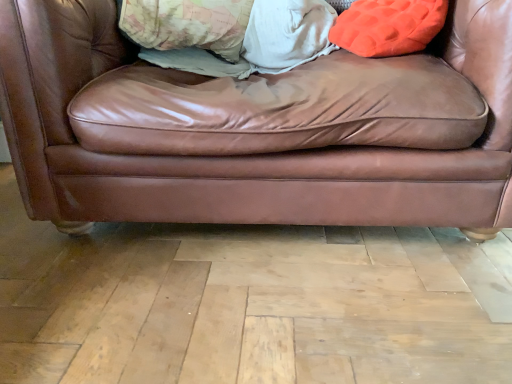
Image resolution: width=512 pixels, height=384 pixels. I want to click on brown leather couch at center, so click(x=231, y=137).

This screenshot has height=384, width=512. What do you see at coordinates (388, 26) in the screenshot?
I see `orange fuzzy pillow at upper right` at bounding box center [388, 26].

You are a GUI agent. You are given a task and a screenshot of the screen. Output one action in this format:
    pyautogui.click(x=<x>, y=<y>)
    Task: Click on the orange fuzzy pillow at upper right
    This screenshot has width=512, height=384.
    Given the screenshot: What is the action you would take?
    pyautogui.click(x=388, y=26)

Where is `brown leather couch at center`? The image size is (512, 384). brown leather couch at center is located at coordinates (231, 137).

Is patterned fabric pillow at upper center taller than orange fuzzy pillow at upper right?

Indeed, patterned fabric pillow at upper center has a greater height compared to orange fuzzy pillow at upper right.

This screenshot has width=512, height=384. Find the location of `throw pillow in front of the patterned fabric pillow at upper center`. throw pillow in front of the patterned fabric pillow at upper center is located at coordinates (388, 26).

Would you say patterned fabric pillow at upper center is to the left or to the right of orange fuzzy pillow at upper right in the picture?

Based on their positions, patterned fabric pillow at upper center is located to the left of orange fuzzy pillow at upper right.

Who is smaller, patterned fabric pillow at upper center or orange fuzzy pillow at upper right?

Smaller between the two is orange fuzzy pillow at upper right.

How far apart are orange fuzzy pillow at upper right and patterned fabric pillow at upper center?

They are 17.30 inches apart.

From the image's perspective, is orange fuzzy pillow at upper right below patterned fabric pillow at upper center?

Indeed, from the image's perspective, orange fuzzy pillow at upper right is shown beneath patterned fabric pillow at upper center.

Is orange fuzzy pillow at upper right at the left side of patterned fabric pillow at upper center?

Incorrect, orange fuzzy pillow at upper right is not on the left side of patterned fabric pillow at upper center.

Can we say orange fuzzy pillow at upper right lies outside patterned fabric pillow at upper center?

Indeed, orange fuzzy pillow at upper right is completely outside patterned fabric pillow at upper center.

Is point (14, 103) farther from viewer compared to point (348, 39)?

No, it is in front of (348, 39).

Does brown leather couch at center have a smaller size compared to orange fuzzy pillow at upper right?

No.

Does point (229, 32) appear closer or farther from the camera than point (324, 170)?

Point (229, 32) is positioned farther from the camera compared to point (324, 170).

Which of these two, patterned fabric pillow at upper center or brown leather couch at center, is smaller?

patterned fabric pillow at upper center is smaller.

Considering the relative sizes of patterned fabric pillow at upper center and brown leather couch at center in the image provided, is patterned fabric pillow at upper center wider than brown leather couch at center?

No.

Is brown leather couch at center behind patterned fabric pillow at upper center?

No, brown leather couch at center is closer to the viewer.

Is patterned fabric pillow at upper center completely or partially inside brown leather couch at center?

Yes, patterned fabric pillow at upper center is inside brown leather couch at center.

Between brown leather couch at center and patterned fabric pillow at upper center, which one has smaller width?

Thinner between the two is patterned fabric pillow at upper center.

Considering the relative sizes of brown leather couch at center and patterned fabric pillow at upper center in the image provided, is brown leather couch at center smaller than patterned fabric pillow at upper center?

No.

Would you say orange fuzzy pillow at upper right is a long distance from brown leather couch at center?

They are positioned close to each other.

Where is `throw pillow on the right of brown leather couch at center`? This screenshot has width=512, height=384. throw pillow on the right of brown leather couch at center is located at coordinates (388, 26).

Would you say orange fuzzy pillow at upper right is inside or outside brown leather couch at center?

orange fuzzy pillow at upper right is inside brown leather couch at center.

The width and height of the screenshot is (512, 384). Identify the location of pillow on the left of orange fuzzy pillow at upper right. (187, 24).

Find the location of a particular element. Image resolution: width=512 pixels, height=384 pixels. pillow lying above the orange fuzzy pillow at upper right (from the image's perspective) is located at coordinates (187, 24).

From the image, which object appears to be farther from orange fuzzy pillow at upper right, brown leather couch at center or patterned fabric pillow at upper center?

The object further to orange fuzzy pillow at upper right is patterned fabric pillow at upper center.

Considering their positions, is patterned fabric pillow at upper center positioned further to orange fuzzy pillow at upper right than brown leather couch at center?

patterned fabric pillow at upper center is positioned further to the anchor orange fuzzy pillow at upper right.

Estimate the real-world distances between objects in this image. Which object is further from patterned fabric pillow at upper center, orange fuzzy pillow at upper right or brown leather couch at center?

The object further to patterned fabric pillow at upper center is orange fuzzy pillow at upper right.

Considering their positions, is brown leather couch at center positioned closer to patterned fabric pillow at upper center than orange fuzzy pillow at upper right?

Based on the image, brown leather couch at center appears to be nearer to patterned fabric pillow at upper center.

From the image, which object appears to be nearer to brown leather couch at center, orange fuzzy pillow at upper right or patterned fabric pillow at upper center?

Based on the image, orange fuzzy pillow at upper right appears to be nearer to brown leather couch at center.

From the image, which object appears to be farther from brown leather couch at center, patterned fabric pillow at upper center or orange fuzzy pillow at upper right?

Among the two, patterned fabric pillow at upper center is located further to brown leather couch at center.

Locate an element on the screen. studio couch between patterned fabric pillow at upper center and orange fuzzy pillow at upper right in the horizontal direction is located at coordinates (231, 137).